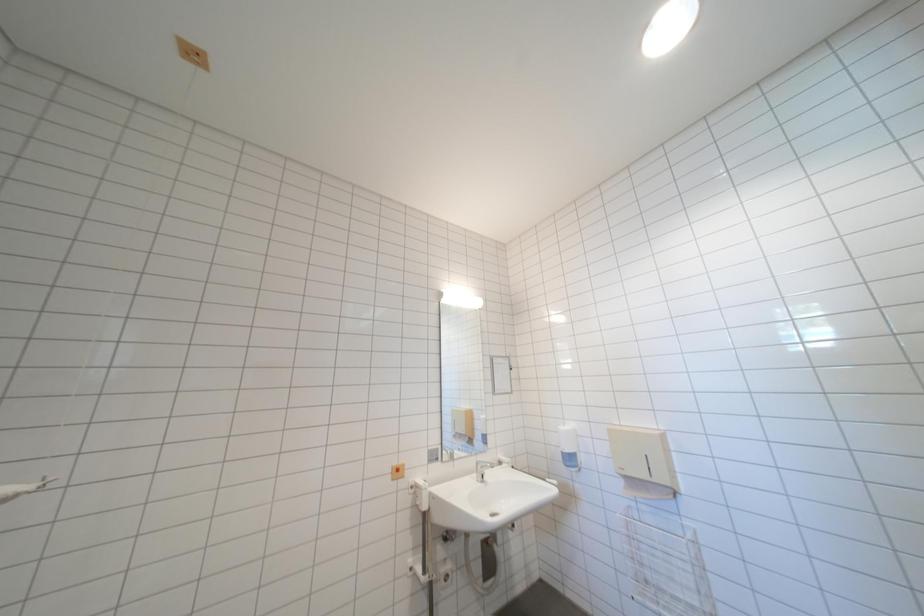
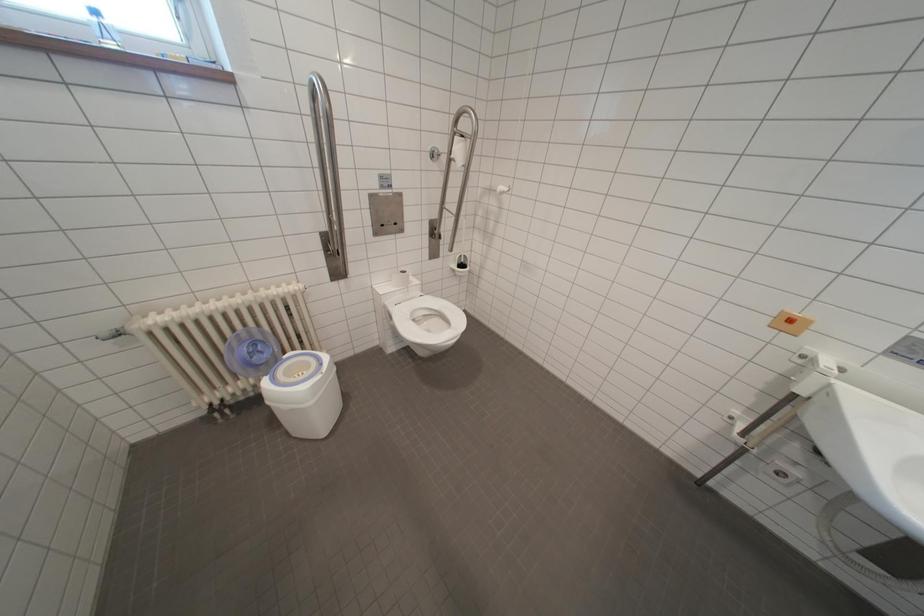
How did the camera likely rotate?

The camera's rotation is toward left-down.